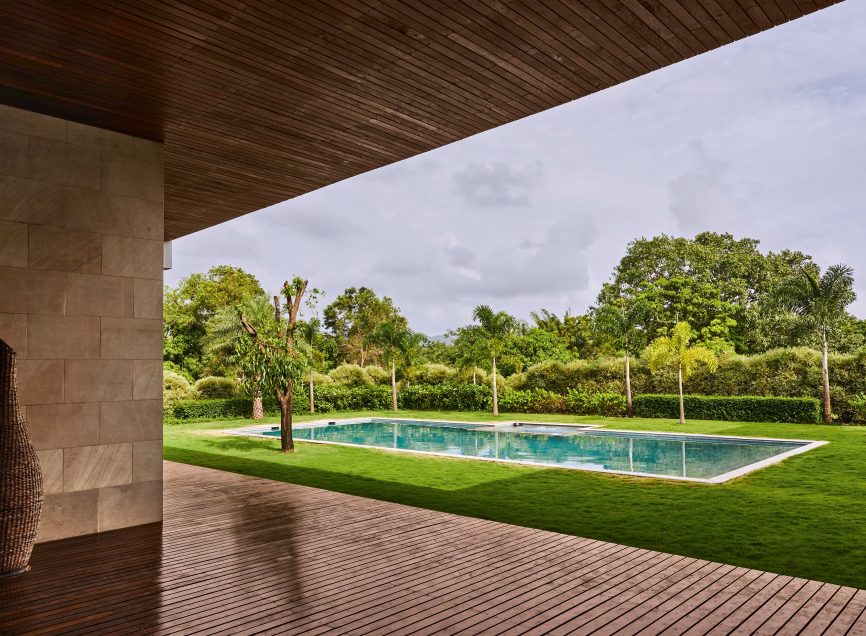
Locate an element on the screen. The width and height of the screenshot is (866, 636). wood panel roof is located at coordinates [451, 70].